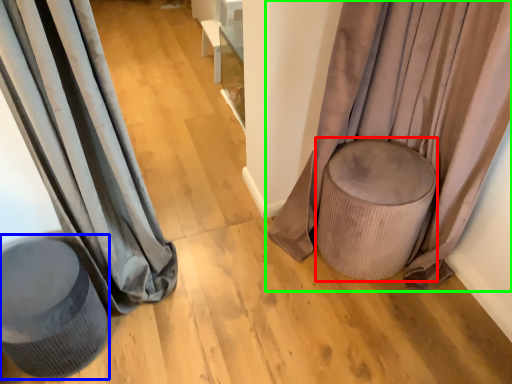
Question: Which object is positioned closest to music stool (highlighted by a red box)? Select from swivel chair (highlighted by a blue box) and curtain (highlighted by a green box).

Choices:
 (A) swivel chair
 (B) curtain

Answer: (B)